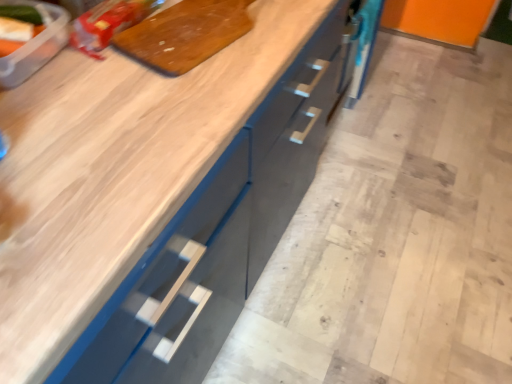
Find the location of `vacant space in front of matte plastic bag at upper left, the 1th food viewed from the right`. vacant space in front of matte plastic bag at upper left, the 1th food viewed from the right is located at coordinates (98, 79).